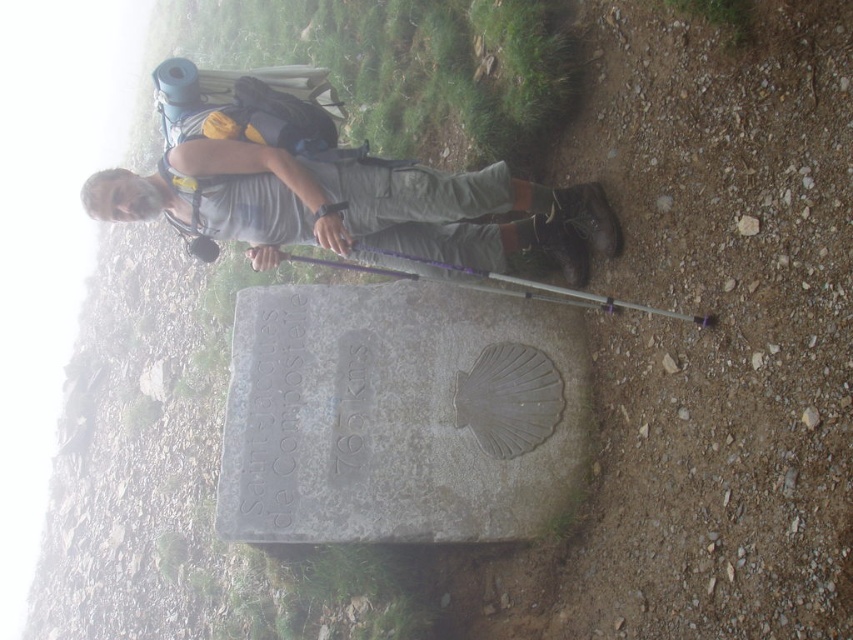
You are a photographer trying to capture the hiker and the stone marker. You want to ensure both the gray fabric backpack at upper center and the purple plastic ski pole at center are visible in the frame. Based on their positions, which object should you focus on first to include both in the shot?

The gray fabric backpack at upper center is above the purple plastic ski pole at center, so you should focus on the gray fabric backpack at upper center first to ensure both are in the frame.

You are a hiker who wants to read the text engraved on the gray stone marker at center. Can you read it clearly from where you are standing?

The gray stone marker at center is 9.00 meters away from you, so you can read the text engraved on it clearly from where you are standing.

You are a hiker who wants to take a photo of the gray stone marker at center and the gray fabric backpack at upper center. Which object should you focus on first if you want to capture both in the frame without moving your camera?

You should focus on the gray fabric backpack at upper center first because the gray stone marker at center is to the right of it, ensuring both are in the frame without needing to adjust the camera position.